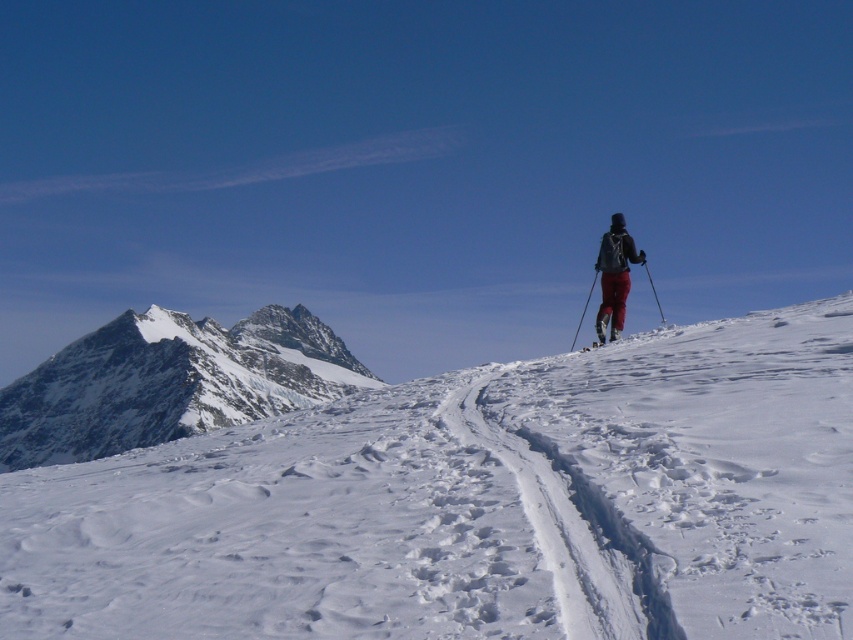
Between point (473, 470) and point (576, 333), which one is positioned in front?

Point (473, 470)

Measure the distance from white powdery snow at center to matte black ski pole at right.

white powdery snow at center and matte black ski pole at right are 24.06 meters apart from each other.

Which is behind, point (488, 554) or point (572, 348)?

The point (572, 348) is behind.

Where is `white powdery snow at center`? white powdery snow at center is located at coordinates (477, 504).

Does white snow-covered mountain at upper left have a larger size compared to matte black ski at upper right?

Indeed, white snow-covered mountain at upper left has a larger size compared to matte black ski at upper right.

Does white snow-covered mountain at upper left come in front of matte black ski at upper right?

No, it is not.

Is point (321, 378) closer to viewer compared to point (595, 340)?

No, (321, 378) is behind (595, 340).

Image resolution: width=853 pixels, height=640 pixels. I want to click on white snow-covered mountain at upper left, so click(x=169, y=381).

Measure the distance between red fabric pants at right and camera.

They are 60.50 meters apart.

Is point (625, 268) positioned after point (659, 305)?

No, (625, 268) is closer to viewer.

The image size is (853, 640). Describe the element at coordinates (614, 275) in the screenshot. I see `red fabric pants at right` at that location.

The width and height of the screenshot is (853, 640). What are the coordinates of `red fabric pants at right` in the screenshot? It's located at click(614, 275).